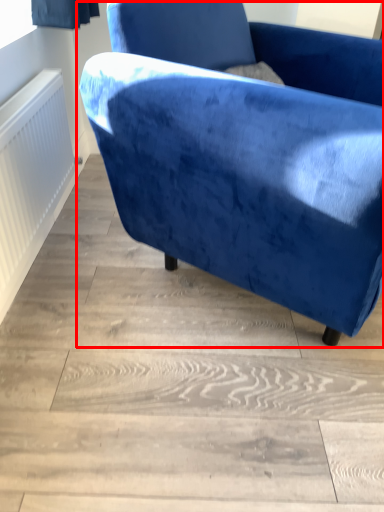
Question: Considering the relative positions of chair (annotated by the red box) and radiator in the image provided, where is chair (annotated by the red box) located with respect to the staircase?

Choices:
 (A) left
 (B) right

Answer: (B)